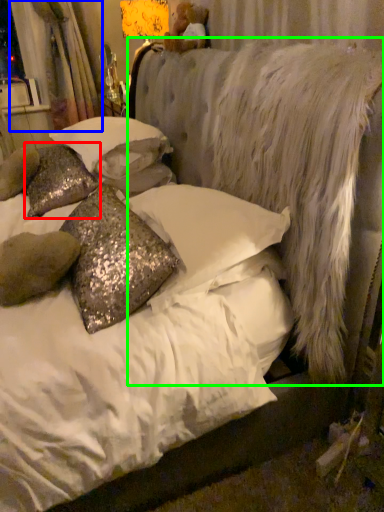
Question: Which object is positioned farthest from pillow (highlighted by a red box)? Select from curtain (highlighted by a blue box) and mattress (highlighted by a green box).

Choices:
 (A) curtain
 (B) mattress

Answer: (A)